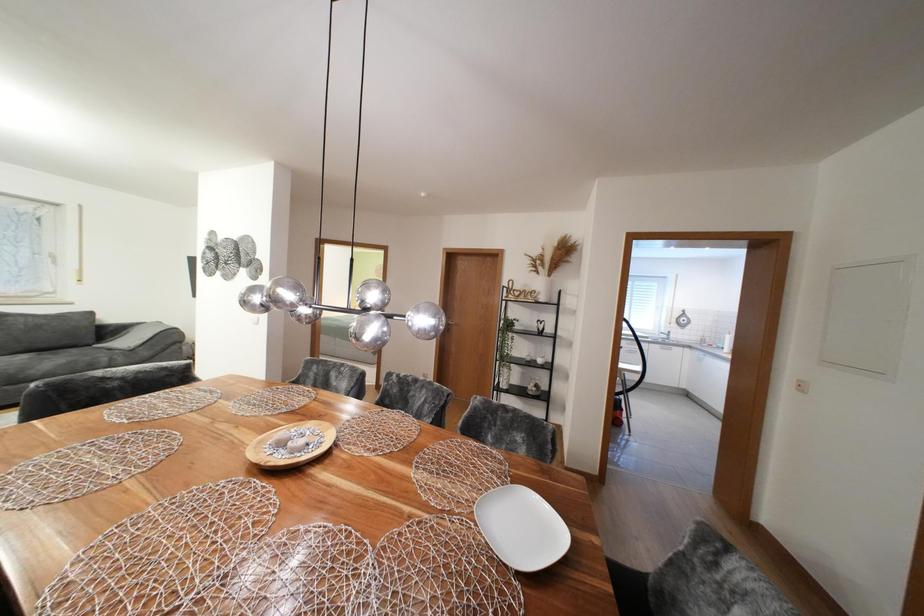
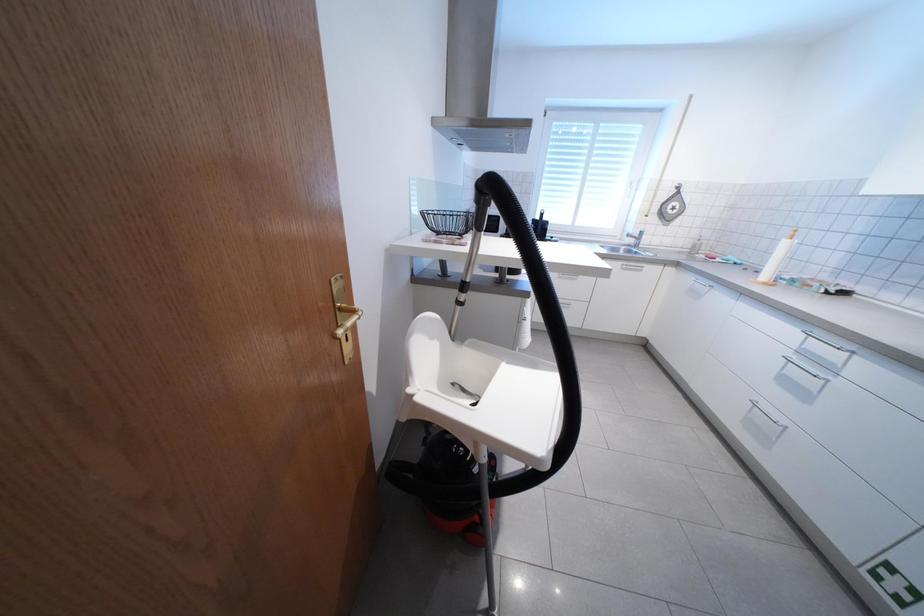
In a continuous first-person perspective shot, in which direction is the camera moving?

The movement direction of the cameraman is right, forward.